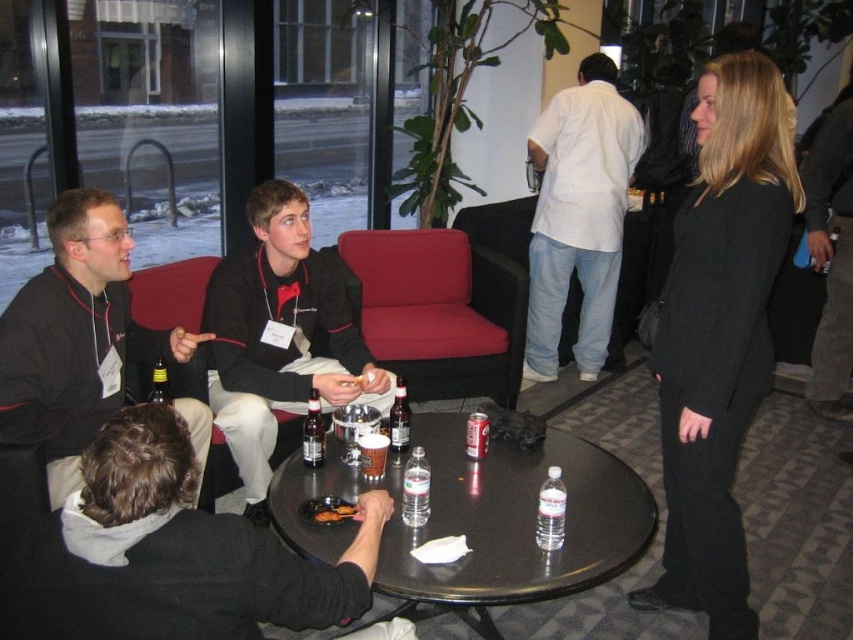
Is point (793, 112) farther from camera compared to point (567, 244)?

No, (793, 112) is in front of (567, 244).

The height and width of the screenshot is (640, 853). I want to click on black wool suit at right, so click(720, 332).

Between point (94, 412) and point (547, 296), which one is positioned in front?

Point (94, 412) is in front.

Between matte black jacket at left and white cotton shirt at center, which one has more height?

white cotton shirt at center

Between point (111, 216) and point (534, 364), which one is positioned in front?

Point (111, 216) is in front.

I want to click on matte black jacket at left, so click(74, 339).

Is matte black shirt at center further to the viewer compared to dark brown glass bottle at table center?

Yes, it is behind dark brown glass bottle at table center.

Between point (285, 310) and point (320, 461), which one is positioned in front?

Point (320, 461) is in front.

Locate an element on the screen. matte black shirt at center is located at coordinates (280, 337).

Locate an element on the screen. The image size is (853, 640). matte black shirt at center is located at coordinates (280, 337).